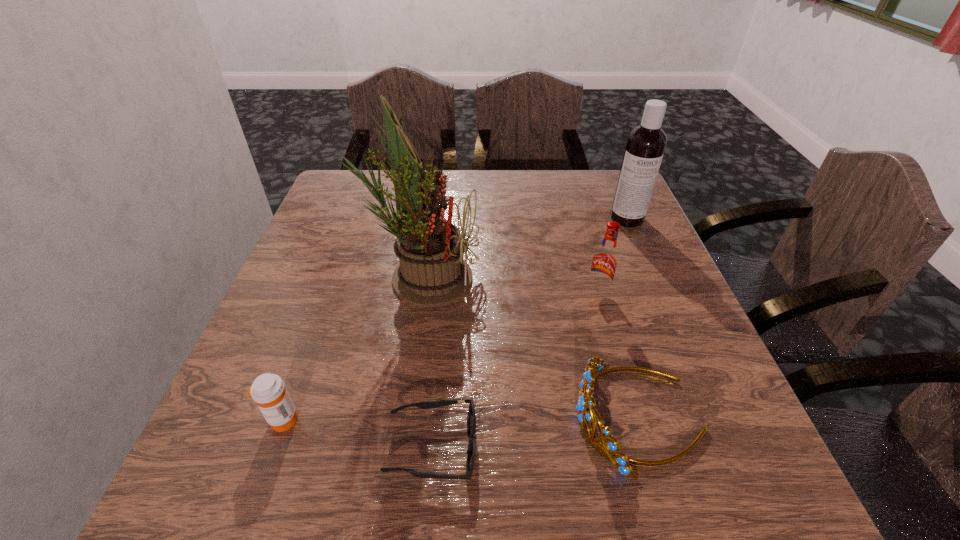
Identify which object is the fifth nearest to the shortest object. Please provide its 2D coordinates. Your answer should be formatted as a tuple, i.e. [(x, y)], where the tuple contains the x and y coordinates of a point satisfying the conditions above.

[(646, 143)]

I want to click on vacant region that satisfies the following two spatial constraints: 1. on the label side of the fifth shortest object; 2. on the front-facing side of the sunglasses, so click(x=726, y=447).

This screenshot has width=960, height=540. Find the location of `vacant region that satisfies the following two spatial constraints: 1. in front of the flower arrangement with the fan visible; 2. on the left side of the fourth shortest object`. vacant region that satisfies the following two spatial constraints: 1. in front of the flower arrangement with the fan visible; 2. on the left side of the fourth shortest object is located at coordinates (421, 292).

Find the location of a particular element. free space in the image that satisfies the following two spatial constraints: 1. on the front side of the third tallest object; 2. on the front-facing side of the shortest object is located at coordinates (642, 447).

I want to click on free space that satisfies the following two spatial constraints: 1. in front of the flower arrangement with the fan visible; 2. on the front side of the leftmost object, so click(403, 420).